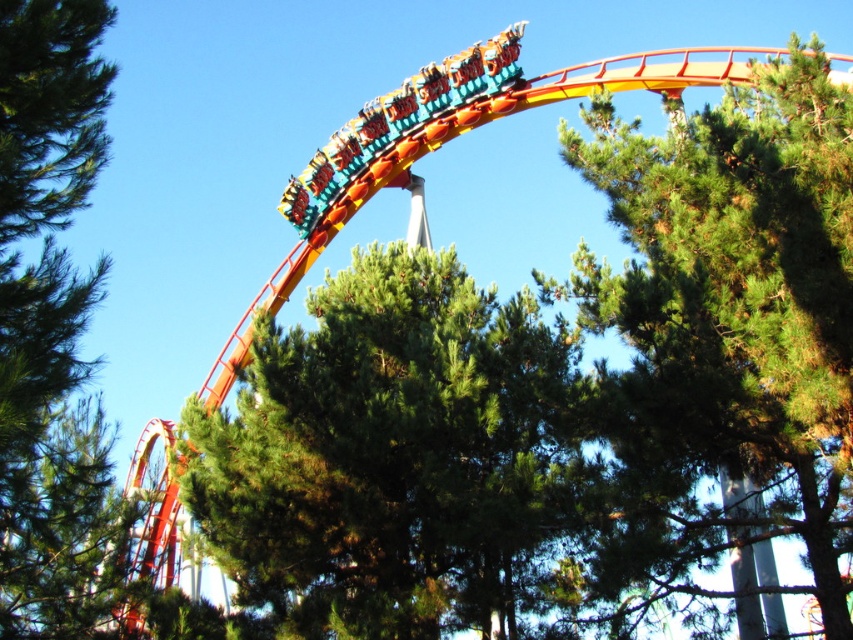
You are standing in the amusement park and see the green textured tree at center and the green leafy tree at upper left. Which tree is more to the right?

The green textured tree at center is more to the right side of the green leafy tree at upper left.